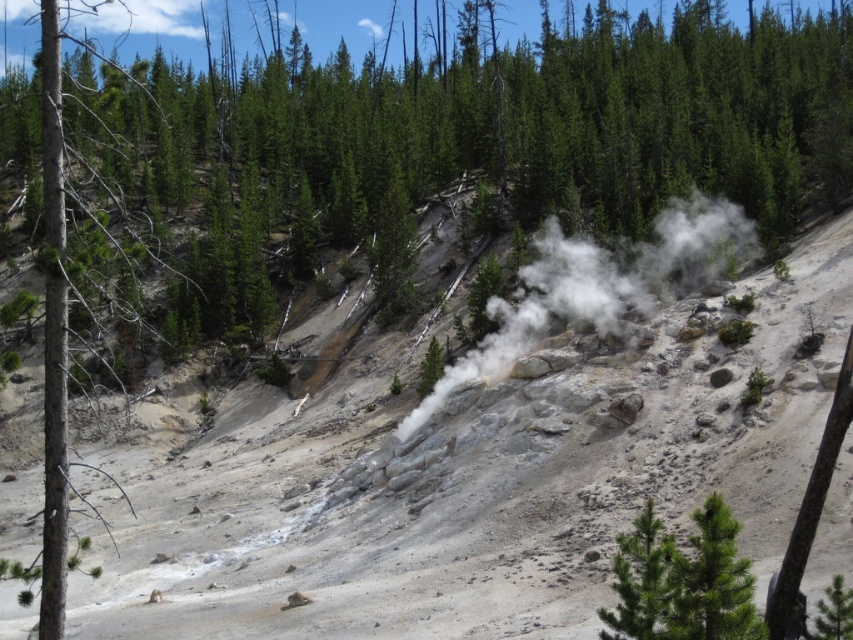
Is gray rocky hillside at center closer to the viewer compared to white steam at center?

Yes, it is.

Can you confirm if gray rocky hillside at center is bigger than white steam at center?

Yes.

Describe the element at coordinates (473, 474) in the screenshot. I see `gray rocky hillside at center` at that location.

This screenshot has width=853, height=640. Find the location of `gray rocky hillside at center`. gray rocky hillside at center is located at coordinates (473, 474).